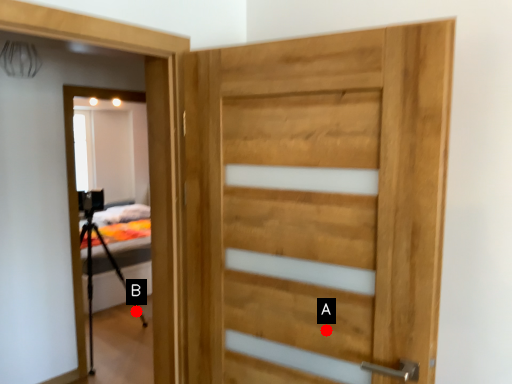
Question: Two points are circled on the image, labeled by A and B beside each circle. Which point appears farthest from the camera in this image?

Choices:
 (A) A is further
 (B) B is further

Answer: (B)